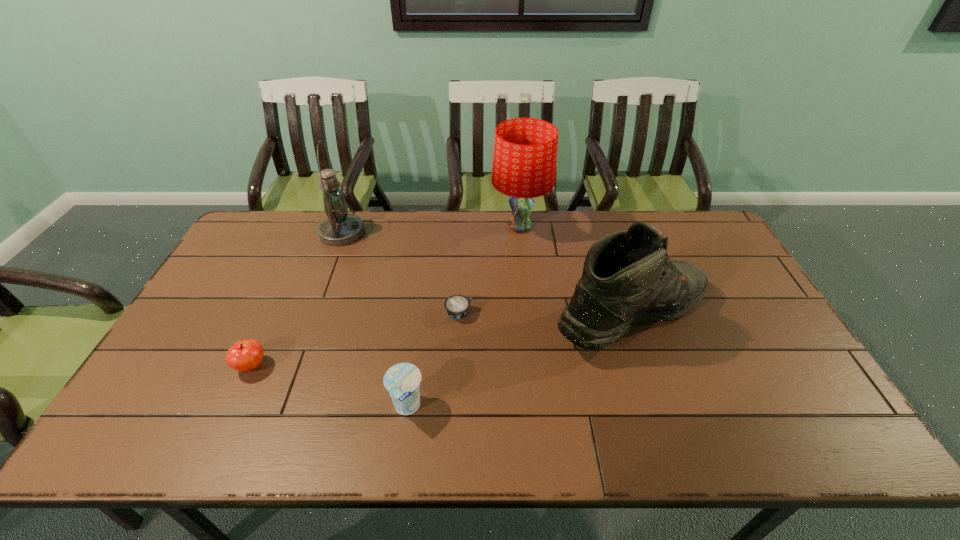
The image size is (960, 540). In order to click on vacant space located on the left of the ski boot in this screenshot , I will do `click(473, 316)`.

Where is `vacant space located on the back of the third shortest object`? vacant space located on the back of the third shortest object is located at coordinates (418, 327).

This screenshot has width=960, height=540. In order to click on vacant space positioned on the back of the apple in this screenshot , I will do `click(290, 281)`.

At what (x,y) coordinates should I click in order to perform the action: click on vacant area situated 0.380m on the back of the shortest object. Please return your answer as a coordinate pair (x, y). The width and height of the screenshot is (960, 540). Looking at the image, I should click on (463, 228).

Locate an element on the screen. lampshade that is at the far edge is located at coordinates (525, 149).

Locate an element on the screen. The image size is (960, 540). oil lamp at the far edge is located at coordinates (340, 228).

Find the location of a particular element. The height and width of the screenshot is (540, 960). object at the near edge is located at coordinates (402, 381).

Locate an element on the screen. object located at the right edge is located at coordinates (628, 276).

The width and height of the screenshot is (960, 540). Find the location of `free spot at the far edge of the desktop`. free spot at the far edge of the desktop is located at coordinates (607, 217).

You are a GUI agent. You are given a task and a screenshot of the screen. Output one action in this format:
    pyautogui.click(x=<x>, y=<y>)
    Task: Click on the free space at the near edge
    
    Given the screenshot: What is the action you would take?
    pyautogui.click(x=600, y=440)